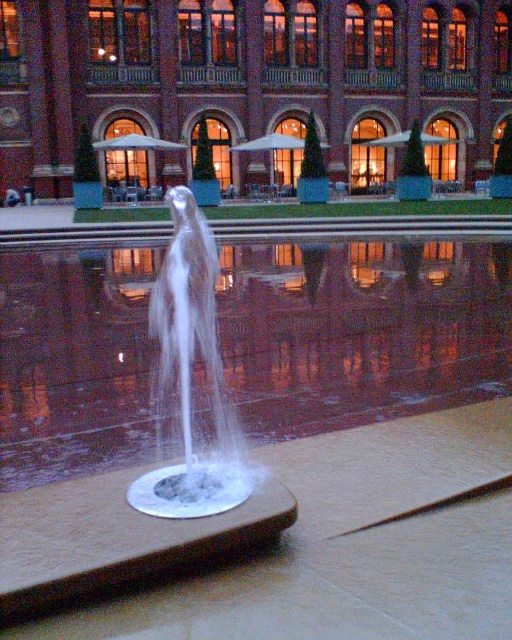
Is clear liquid water at center smaller than white translucent water at center?

Yes, clear liquid water at center is smaller than white translucent water at center.

Is clear liquid water at center positioned behind white translucent water at center?

Yes, it is behind white translucent water at center.

Does point (503, 337) come behind point (197, 288)?

Yes.

This screenshot has width=512, height=640. What are the coordinates of `clear liquid water at center` in the screenshot? It's located at (361, 330).